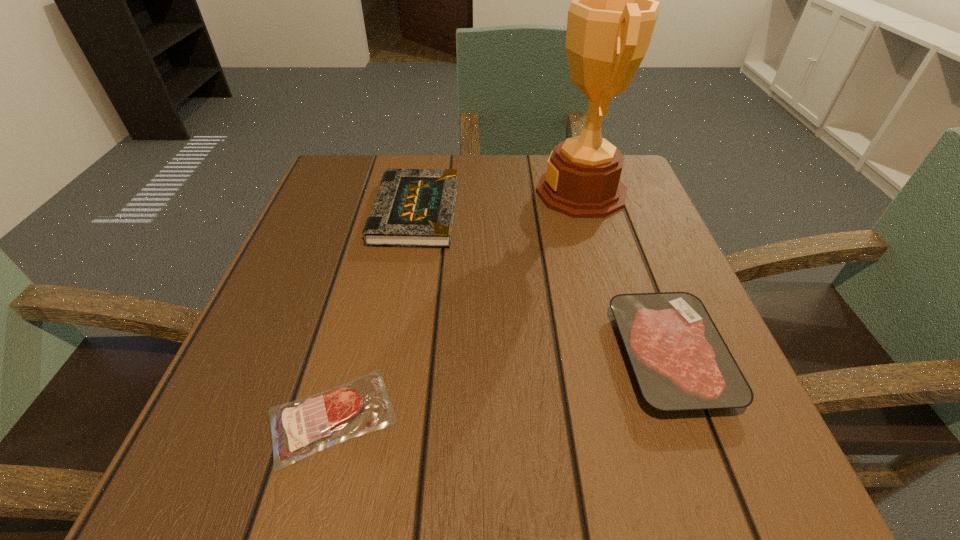
I want to click on empty space between the third shortest object and the award, so click(498, 202).

Locate an element on the screen. vacant area that lies between the notebook and the right steak is located at coordinates (x=542, y=284).

Locate an element on the screen. The width and height of the screenshot is (960, 540). free space between the third tallest object and the second tallest object is located at coordinates point(542,284).

Locate an element on the screen. The image size is (960, 540). free space between the second tallest object and the right steak is located at coordinates (542, 284).

This screenshot has width=960, height=540. In order to click on free space between the shortest object and the award in this screenshot , I will do `click(457, 305)`.

The image size is (960, 540). In order to click on free space between the tallest object and the taller steak in this screenshot , I will do `click(625, 274)`.

Locate an element on the screen. Image resolution: width=960 pixels, height=540 pixels. free space that is in between the notebook and the second shortest object is located at coordinates (542, 284).

This screenshot has width=960, height=540. I want to click on unoccupied position between the second shortest object and the notebook, so click(542, 284).

You are a GUI agent. You are given a task and a screenshot of the screen. Output one action in this format:
    pyautogui.click(x=<x>, y=<y>)
    Task: Click on the vacant space that is in between the notebook and the left steak
    This screenshot has height=540, width=960.
    Given the screenshot: What is the action you would take?
    pyautogui.click(x=373, y=314)

I want to click on vacant area that lies between the shorter steak and the second tallest object, so click(373, 314).